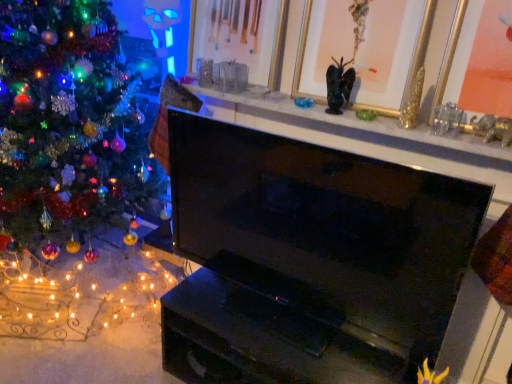
Question: Considering the relative sizes of black glossy tv at center and gold metallic picture frame at upper right, which appears as the first picture frame when viewed from the right, in the image provided, is black glossy tv at center wider than gold metallic picture frame at upper right, which appears as the first picture frame when viewed from the right,?

Choices:
 (A) no
 (B) yes

Answer: (A)

Question: Is black glossy tv at center oriented towards gold metallic picture frame at upper right, the third picture frame positioned from the left?

Choices:
 (A) yes
 (B) no

Answer: (B)

Question: From the image's perspective, would you say black glossy tv at center is positioned over gold metallic picture frame at upper right, the third picture frame positioned from the left?

Choices:
 (A) yes
 (B) no

Answer: (B)

Question: Does black glossy tv at center appear on the right side of gold metallic picture frame at upper right, which appears as the first picture frame when viewed from the right?

Choices:
 (A) no
 (B) yes

Answer: (A)

Question: Is gold metallic picture frame at upper right, which appears as the first picture frame when viewed from the right, completely or partially inside black glossy tv at center?

Choices:
 (A) yes
 (B) no

Answer: (B)

Question: Does black glossy tv at center have a lesser width compared to gold metallic picture frame at upper right, the third picture frame positioned from the left?

Choices:
 (A) yes
 (B) no

Answer: (A)

Question: Can you confirm if matte black fireplace at upper center is taller than gold/gilded picture frame at upper center, which is the 2th picture frame from right to left?

Choices:
 (A) no
 (B) yes

Answer: (A)

Question: From the image's perspective, is matte black fireplace at upper center over gold/gilded picture frame at upper center, which is the 2th picture frame from right to left?

Choices:
 (A) no
 (B) yes

Answer: (A)

Question: Is matte black fireplace at upper center to the right of gold/gilded picture frame at upper center, which is the 2th picture frame from right to left, from the viewer's perspective?

Choices:
 (A) yes
 (B) no

Answer: (B)

Question: Is gold/gilded picture frame at upper center, which is the 2th picture frame from right to left, at the back of matte black fireplace at upper center?

Choices:
 (A) yes
 (B) no

Answer: (B)

Question: From a real-world perspective, is matte black fireplace at upper center under gold/gilded picture frame at upper center, the 2th picture frame from the left?

Choices:
 (A) yes
 (B) no

Answer: (A)

Question: Is matte black fireplace at upper center to the left of gold/gilded picture frame at upper center, the 2th picture frame from the left, from the viewer's perspective?

Choices:
 (A) yes
 (B) no

Answer: (A)

Question: Does gold-framed picture at upper center, positioned as the 1th picture frame in left-to-right order, have a smaller size compared to matte black fireplace at upper center?

Choices:
 (A) no
 (B) yes

Answer: (B)